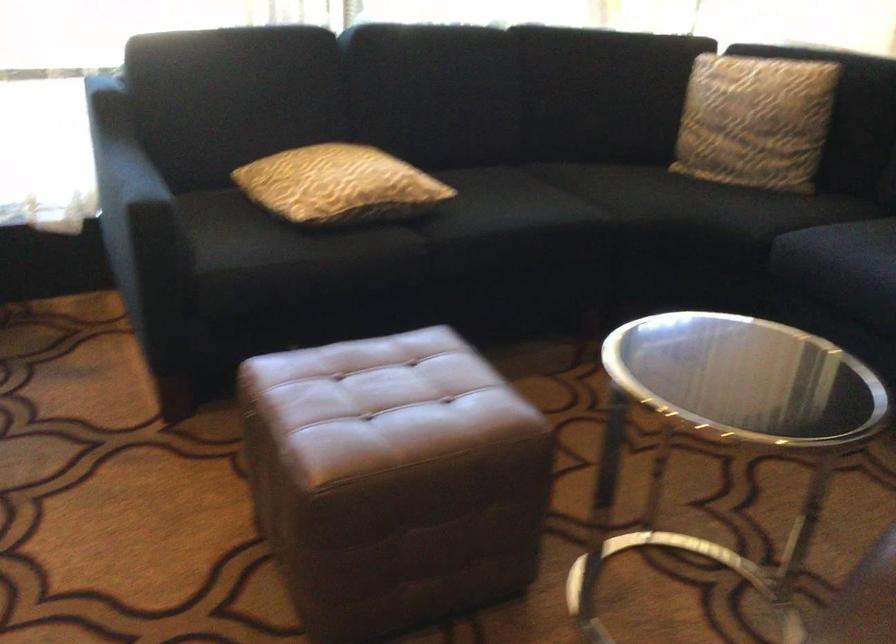
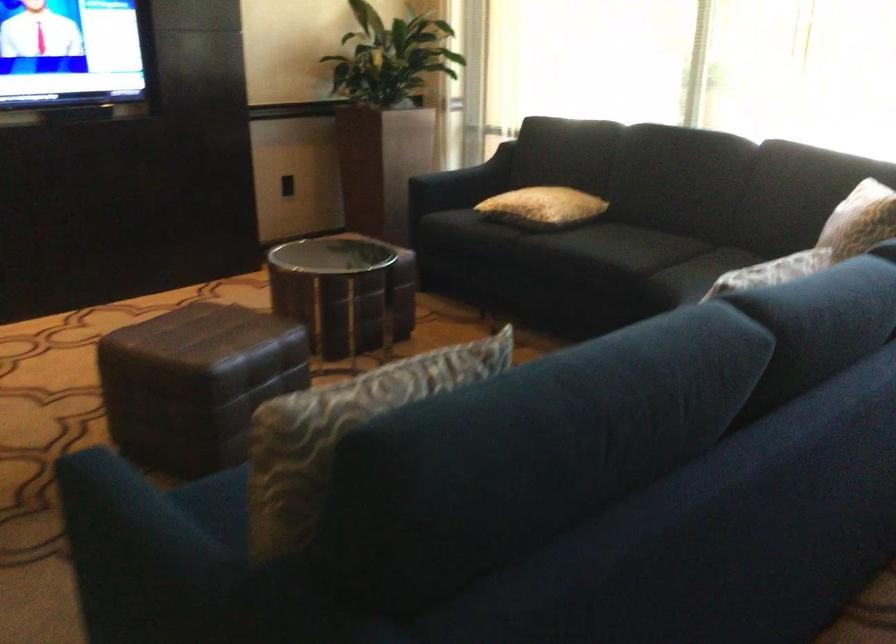
The point at (397, 184) is marked in the first image. Where is the corresponding point in the second image?

(543, 207)